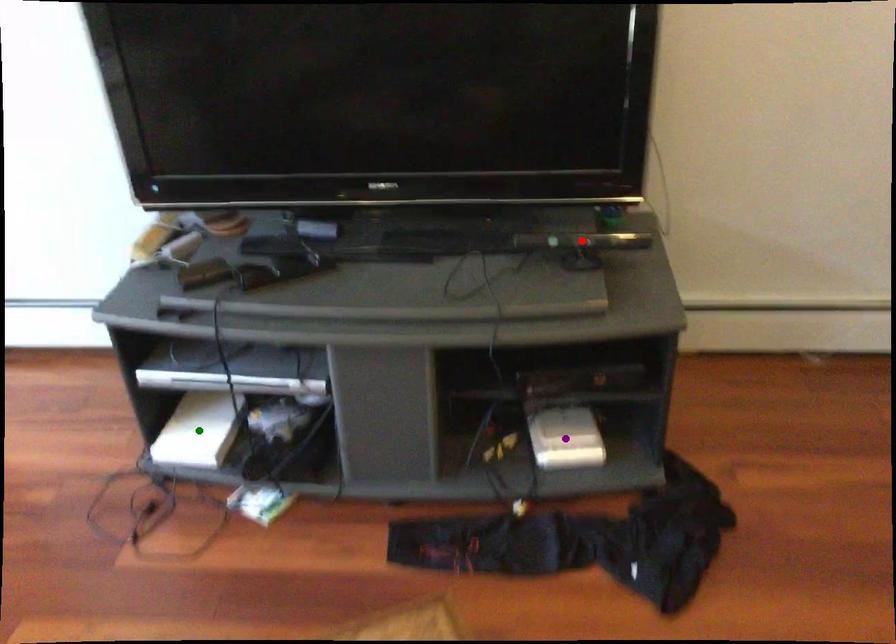
Order these from farthest to nearest:
purple point | red point | green point

green point, purple point, red point